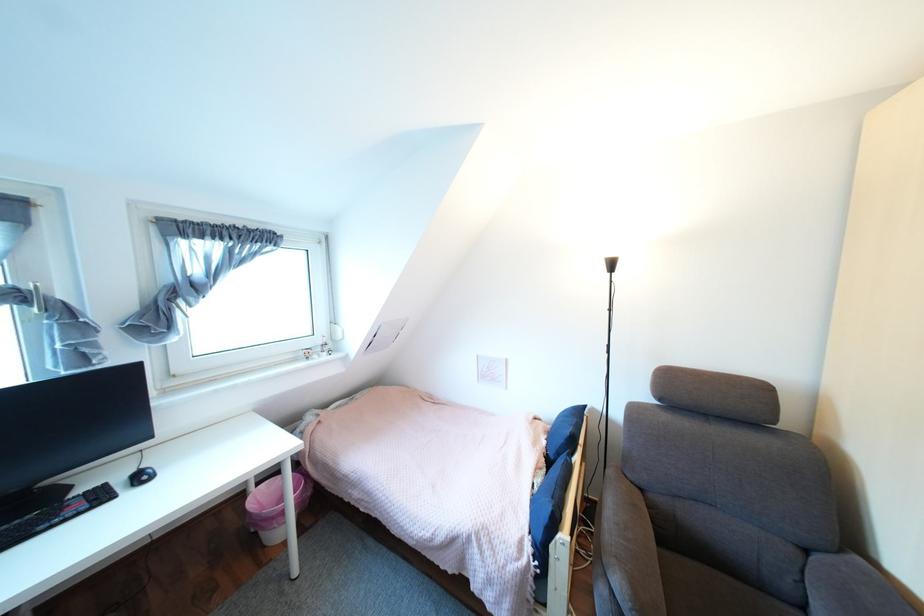
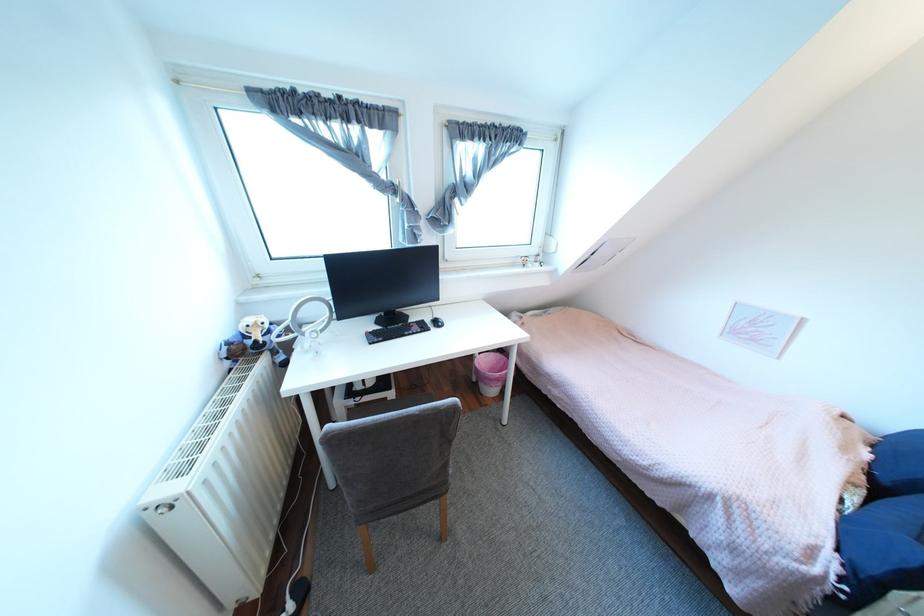
The first image is from the beginning of the video and the second image is from the end. How did the camera likely rotate when shooting the video?

The rotation direction of the camera is left-down.